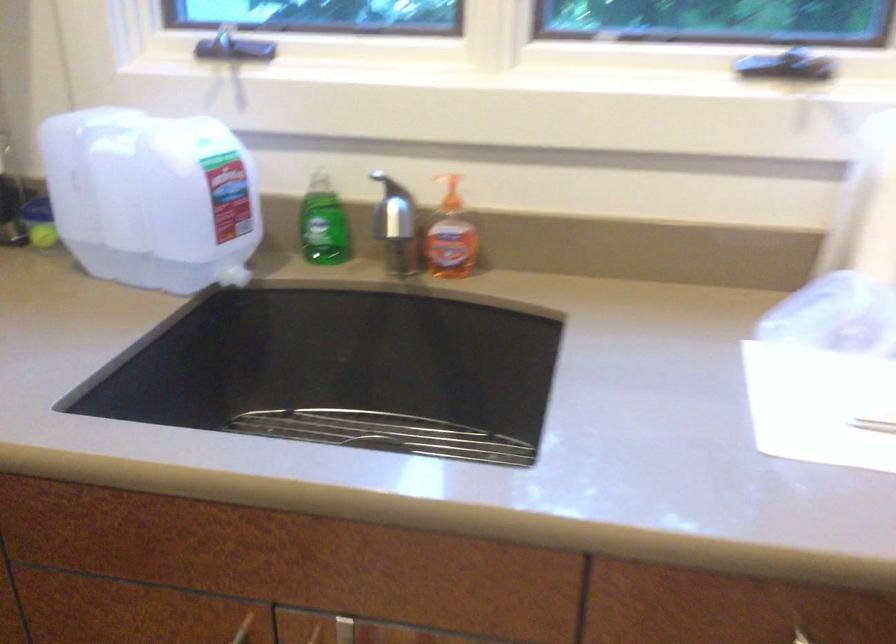
Where would you lift the metal sink rack? Please return your answer as a coordinate pair (x, y).

(385, 433)